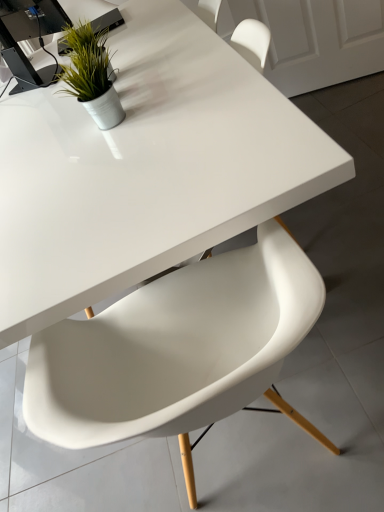
The height and width of the screenshot is (512, 384). I want to click on free space in front of green matte plant at upper left, so click(x=120, y=89).